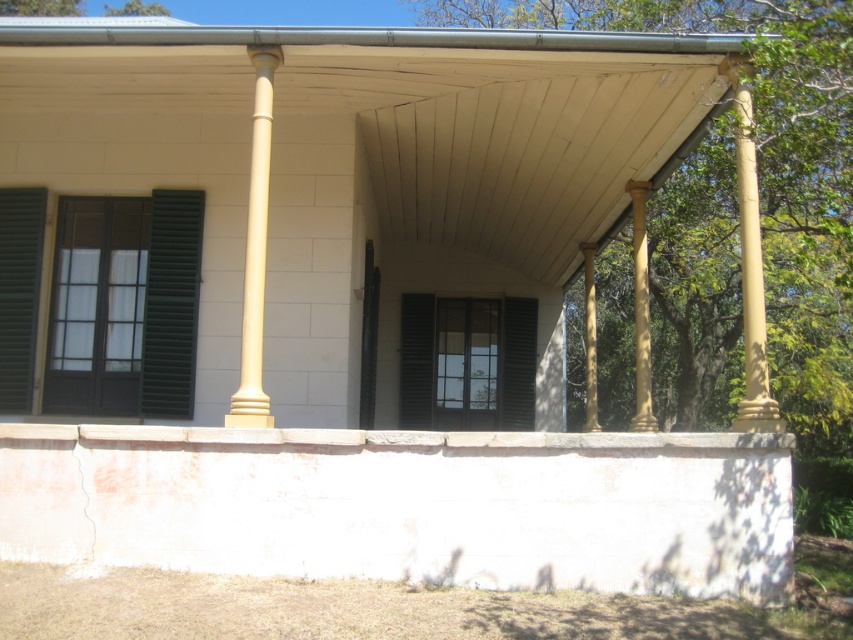
In the scene shown: You are an architect designing a new porch and want to ensure that the shutters and columns are proportionally balanced. Given the dark green matte shutter at left and the golden polished column at center, which object has a smaller width?

The dark green matte shutter at left has a smaller width than the golden polished column at center.

You are an architect inspecting the porch of this building. You notice two columns, the matte gold column at right and the golden polished column at center. Which column is shorter?

The matte gold column at right is shorter than the golden polished column at center.